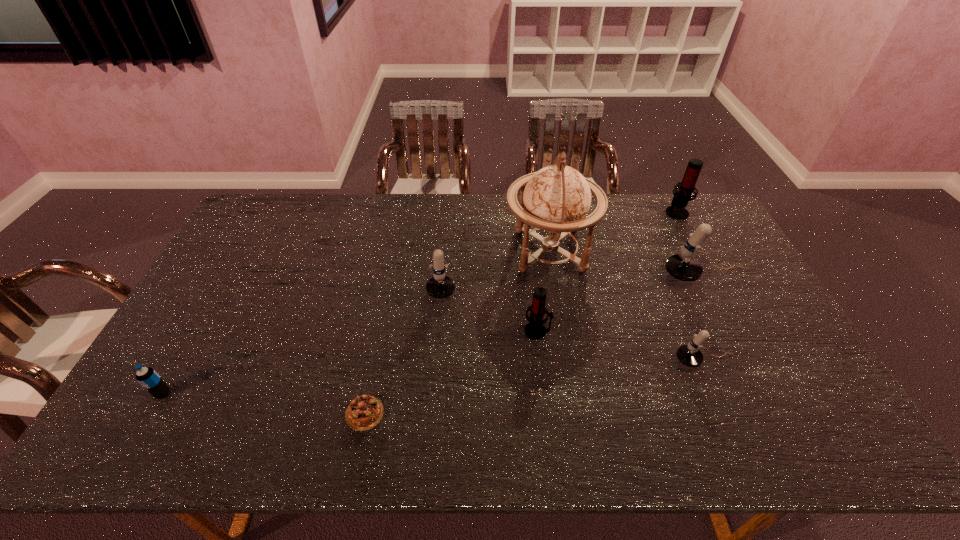
This screenshot has width=960, height=540. I want to click on globe, so click(x=556, y=199).

I want to click on the farther red microphone, so click(x=677, y=210).

The width and height of the screenshot is (960, 540). I want to click on the farthest microphone, so click(x=677, y=210).

The height and width of the screenshot is (540, 960). In order to click on the biggest white microphone in this screenshot , I will do `click(684, 267)`.

The image size is (960, 540). I want to click on the leftmost white microphone, so click(x=440, y=286).

You are a GUI agent. You are given a task and a screenshot of the screen. Output one action in this format:
    pyautogui.click(x=<x>, y=<y>)
    Task: Click on the leftmost microphone
    The height and width of the screenshot is (540, 960).
    Given the screenshot: What is the action you would take?
    pyautogui.click(x=440, y=286)

This screenshot has height=540, width=960. I want to click on the left red microphone, so click(x=535, y=329).

You are a GUI agent. You are given a task and a screenshot of the screen. Output one action in this format:
    pyautogui.click(x=<x>, y=<y>)
    Task: Click on the fourth farthest microphone
    Image resolution: width=960 pixels, height=540 pixels.
    Given the screenshot: What is the action you would take?
    tap(535, 329)

The height and width of the screenshot is (540, 960). Identify the location of the shortest microphone. (690, 355).

Image resolution: width=960 pixels, height=540 pixels. Find the location of `the nearest microphone`. the nearest microphone is located at coordinates (690, 355).